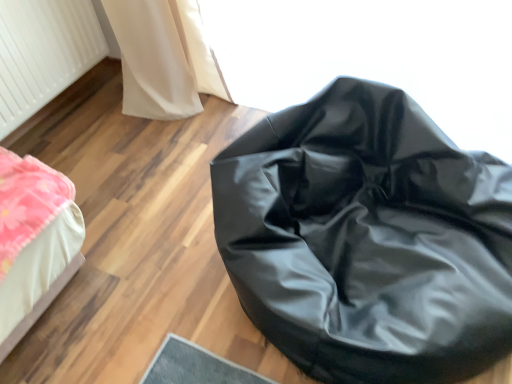
This screenshot has width=512, height=384. In order to click on white textured radiator at upper left in this screenshot , I will do `click(42, 53)`.

Image resolution: width=512 pixels, height=384 pixels. Describe the element at coordinates (42, 53) in the screenshot. I see `white textured radiator at upper left` at that location.

What is the approximate width of black leather bean bag at center?

black leather bean bag at center is 34.70 inches wide.

The width and height of the screenshot is (512, 384). I want to click on black leather bean bag at center, so click(368, 239).

Describe the element at coordinates (368, 239) in the screenshot. I see `black leather bean bag at center` at that location.

Identify the location of white textured radiator at upper left. (42, 53).

Is black leather bean bag at center to the left or to the right of white textured radiator at upper left in the image?

Based on their positions, black leather bean bag at center is located to the right of white textured radiator at upper left.

Considering the positions of objects black leather bean bag at center and white textured radiator at upper left in the image provided, who is in front, black leather bean bag at center or white textured radiator at upper left?

black leather bean bag at center is in front.

Which is closer, [498,237] or [86,33]?

Point [498,237]

From the image's perspective, between black leather bean bag at center and white textured radiator at upper left, which one is located above?

white textured radiator at upper left.

From a real-world perspective, which is physically above, black leather bean bag at center or white textured radiator at upper left?

white textured radiator at upper left.

Looking at their sizes, would you say black leather bean bag at center is wider or thinner than white textured radiator at upper left?

In the image, black leather bean bag at center appears to be wider than white textured radiator at upper left.

Between black leather bean bag at center and white textured radiator at upper left, which one has more height?

black leather bean bag at center.

Does black leather bean bag at center have a larger size compared to white textured radiator at upper left?

Yes, black leather bean bag at center is bigger than white textured radiator at upper left.

Can white textured radiator at upper left be found inside black leather bean bag at center?

No, black leather bean bag at center does not contain white textured radiator at upper left.

Would you consider black leather bean bag at center to be distant from white textured radiator at upper left?

black leather bean bag at center is far away from white textured radiator at upper left.

Looking at this image, does black leather bean bag at center turn towards white textured radiator at upper left?

No, black leather bean bag at center does not turn towards white textured radiator at upper left.

How different are the orientations of black leather bean bag at center and white textured radiator at upper left in degrees?

The angular difference between black leather bean bag at center and white textured radiator at upper left is 3.5e-05 degrees.

At what (x,y) coordinates should I click in order to perform the action: click on furniture on the right of white textured radiator at upper left. Please return your answer as a coordinate pair (x, y). The width and height of the screenshot is (512, 384). Looking at the image, I should click on (368, 239).

Which is more to the left, white textured radiator at upper left or black leather bean bag at center?

white textured radiator at upper left is more to the left.

Who is more distant, white textured radiator at upper left or black leather bean bag at center?

white textured radiator at upper left.

Does point (8, 26) lie behind point (373, 335)?

Yes, it is behind point (373, 335).

From the image's perspective, between white textured radiator at upper left and black leather bean bag at center, who is located below?

black leather bean bag at center.

From a real-world perspective, is white textured radiator at upper left physically below black leather bean bag at center?

No, from a real-world perspective, white textured radiator at upper left is not under black leather bean bag at center.

Is white textured radiator at upper left wider or thinner than black leather bean bag at center?

Clearly, white textured radiator at upper left has less width compared to black leather bean bag at center.

Considering the relative sizes of white textured radiator at upper left and black leather bean bag at center in the image provided, is white textured radiator at upper left taller than black leather bean bag at center?

In fact, white textured radiator at upper left may be shorter than black leather bean bag at center.

Between white textured radiator at upper left and black leather bean bag at center, which one has larger size?

With larger size is black leather bean bag at center.

Would you say black leather bean bag at center is part of white textured radiator at upper left's contents?

No, black leather bean bag at center is not a part of white textured radiator at upper left.

Is the surface of white textured radiator at upper left in direct contact with black leather bean bag at center?

white textured radiator at upper left and black leather bean bag at center are not in contact.

From the picture: Is white textured radiator at upper left facing towards black leather bean bag at center?

Yes, white textured radiator at upper left is facing black leather bean bag at center.

How different are the orientations of white textured radiator at upper left and black leather bean bag at center in degrees?

The facing directions of white textured radiator at upper left and black leather bean bag at center are 3.5e-05 degrees apart.

Find the location of a particular element. This screenshot has height=384, width=512. radiator behind the black leather bean bag at center is located at coordinates (42, 53).

Where is `furniture in front of the white textured radiator at upper left`? furniture in front of the white textured radiator at upper left is located at coordinates (368, 239).

The height and width of the screenshot is (384, 512). I want to click on radiator above the black leather bean bag at center (from the image's perspective), so click(42, 53).